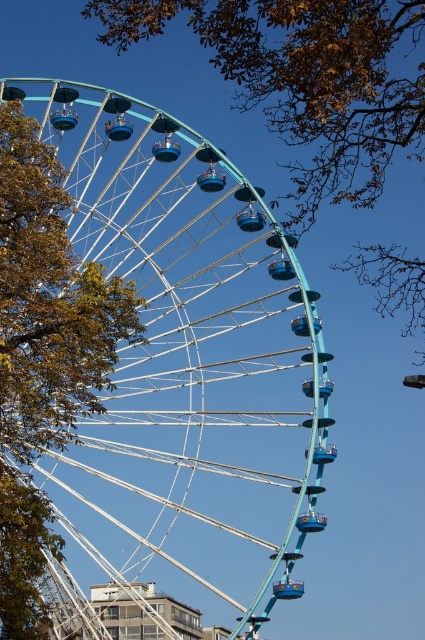
You are standing in front of the teal metallic ferris wheel at center and the brown leafy tree at upper center. Which object appears narrower from your perspective?

The teal metallic ferris wheel at center has a lesser width compared to the brown leafy tree at upper center, so it appears narrower.

You are planning to take a photo of the teal metallic ferris wheel at center and the brown leafy tree at upper center. Which object should you place on the left side of your camera frame to ensure both are visible?

The teal metallic ferris wheel at center is positioned on the left side of brown leafy tree at upper center, so to include both in the frame, you should place the teal metallic ferris wheel at center on the left side of your camera frame.